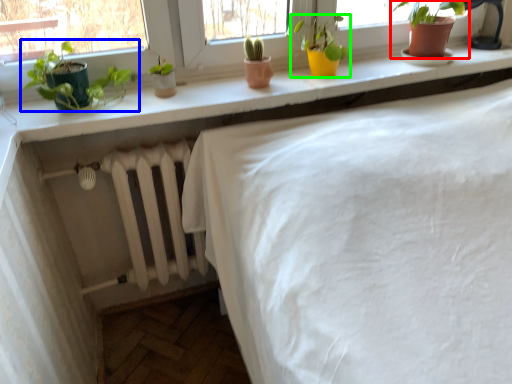
Question: Which object is the closest to the houseplant (highlighted by a red box)? Choose among these: houseplant (highlighted by a blue box) or houseplant (highlighted by a green box).

Choices:
 (A) houseplant
 (B) houseplant

Answer: (B)